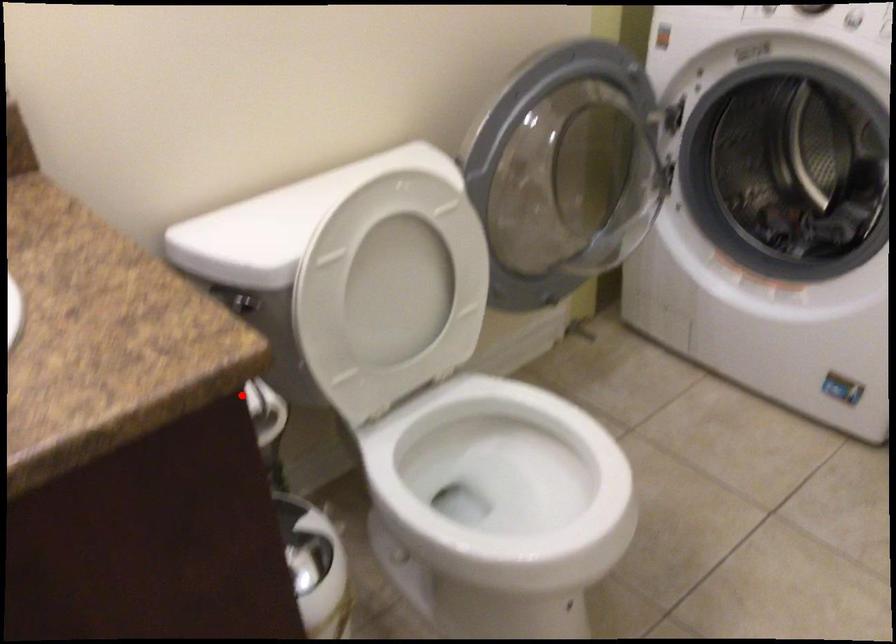
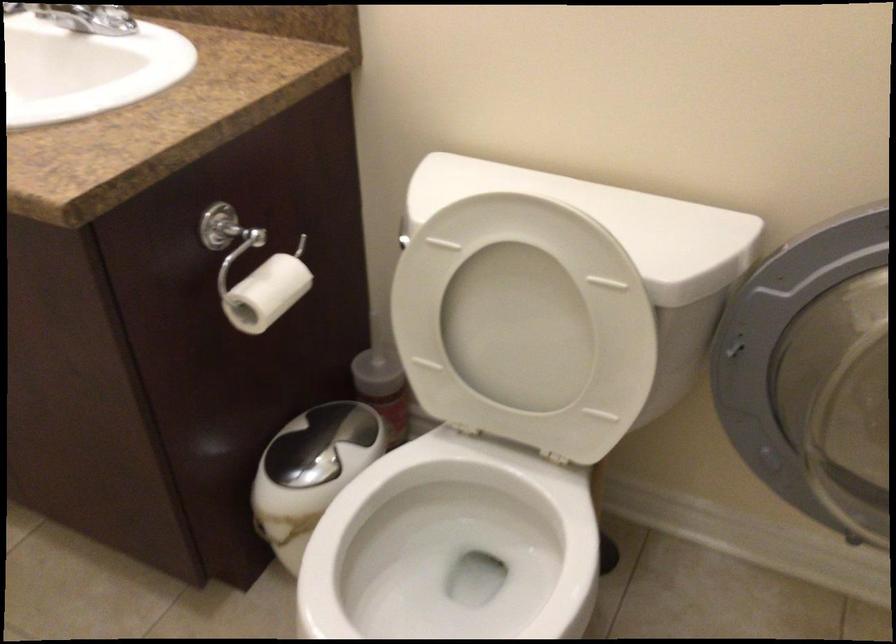
Where in the second image is the point corresponding to the highlighted location from the first image?

(263, 286)